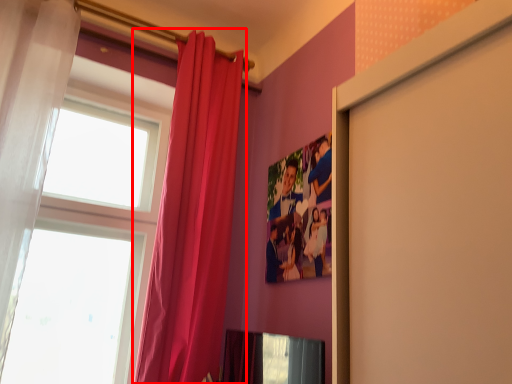
Question: In this image, where is curtain (annotated by the red box) located relative to curtain?

Choices:
 (A) right
 (B) left

Answer: (A)